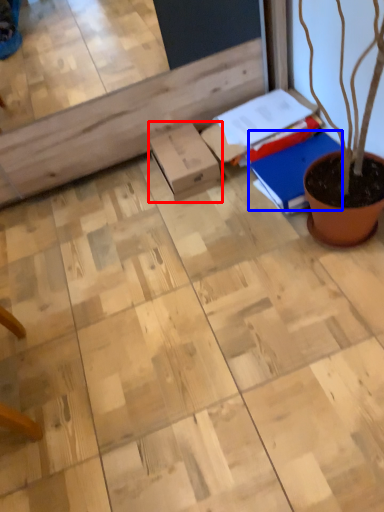
Question: Which point is further to the camera, cardboard box (highlighted by a red box) or notebook (highlighted by a blue box)?

Choices:
 (A) cardboard box
 (B) notebook

Answer: (A)